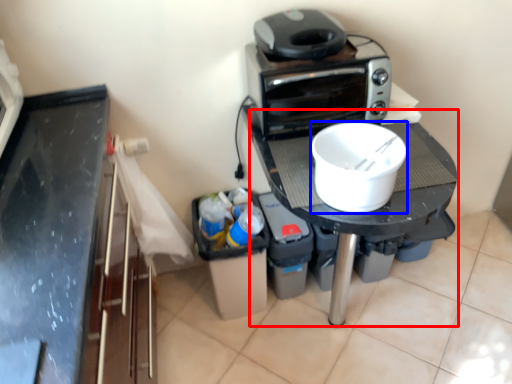
Question: Which object is closer to the camera taking this photo, table (highlighted by a red box) or kitchen appliance (highlighted by a blue box)?

Choices:
 (A) table
 (B) kitchen appliance

Answer: (B)